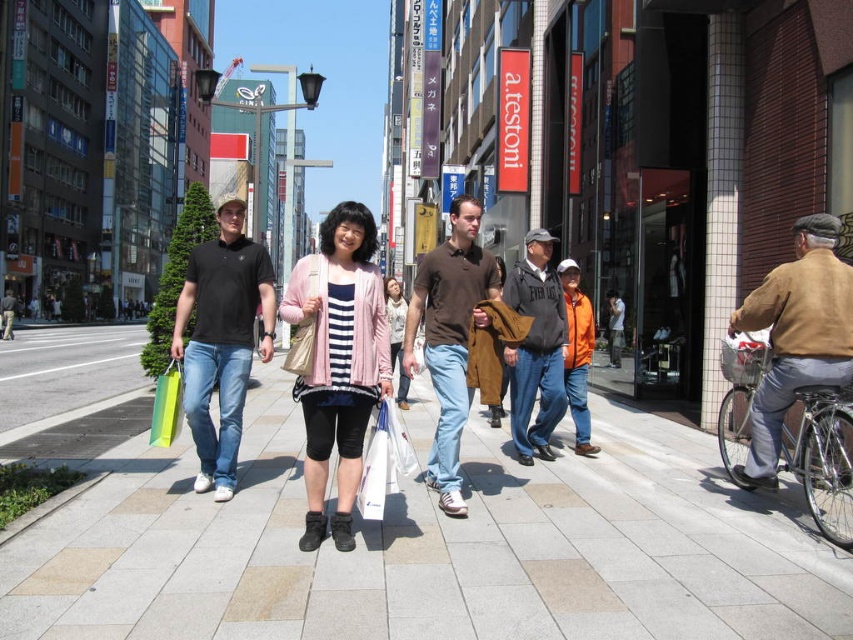
Question: Which is farther from the brown cotton shirt at center?

Choices:
 (A) pink fabric jacket at center
 (B) white plastic bag at center
 (C) green matte shopping bag at lower left

Answer: (C)

Question: Observing the image, what is the correct spatial positioning of brown leather jacket at right in reference to brown cotton shirt at center?

Choices:
 (A) right
 (B) left

Answer: (A)

Question: Does brown leather jacket at right have a smaller size compared to brown cotton shirt at center?

Choices:
 (A) yes
 (B) no

Answer: (B)

Question: Which point is farther to the camera?

Choices:
 (A) matte black polo shirt at left
 (B) brown leather jacket at right
 (C) brown leather jacket at center
 (D) white plastic bag at center

Answer: (C)

Question: Can you confirm if brown leather jacket at center is positioned to the left of white plastic bag at center?

Choices:
 (A) no
 (B) yes

Answer: (A)

Question: Which of the following is the farthest from the observer?

Choices:
 (A) (245, 307)
 (B) (402, 394)
 (C) (271, 588)

Answer: (B)